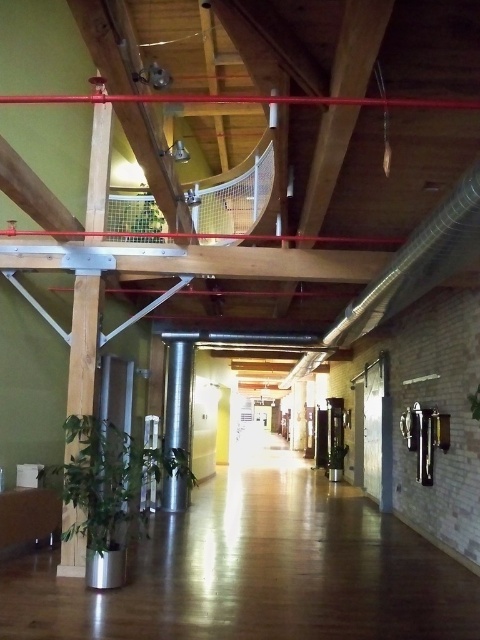
You are a delivery person carrying a package that requires a clear path between the silver metallic pillar at center and the green leafy plant at upper center. The package is 8 feet long. Can you safely move the package through the space between them?

The distance between the silver metallic pillar at center and the green leafy plant at upper center is 7.56 feet. Since the package is 8 feet long, it is slightly longer than the available space, so you cannot safely move the package through the space between them.

You are standing in the hallway and want to move towards the bright light at the far end. There are two points marked in the scene, point A at coordinates point A is point (x=152, y=470) and point B is point (x=191, y=360). Which point is closer to you as you face the direction of the light?

Point A at coordinates point A is point (x=152, y=470) is closer to the viewer than point B is point (x=191, y=360), so the closer point is point A.

You are a decorator planning to place a new rectangular table in the hallway. The table is as wide as the silver metallic pillar at center. Will the green leafy plant at lower left fit next to it without overlapping?

The green leafy plant at lower left is wider than the silver metallic pillar at center. Since the table is as wide as the pillar, placing it next to the plant would require more space than the pillar occupies, so they might overlap unless there is sufficient space between them.